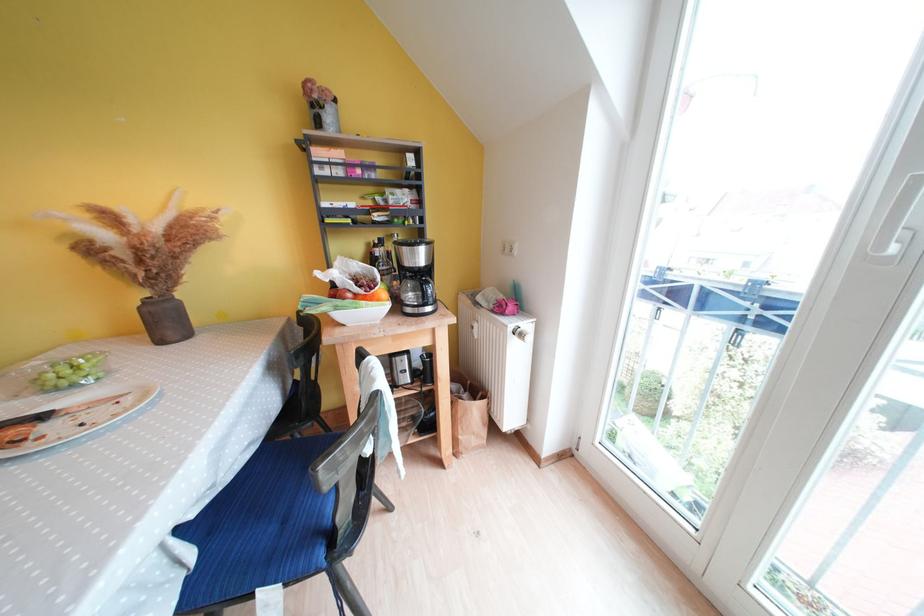
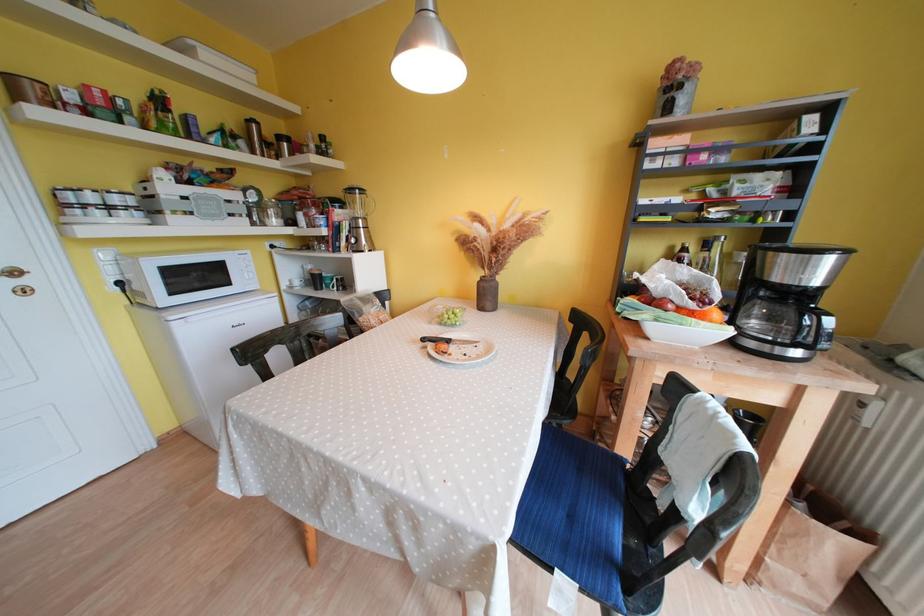
Question: How did the camera likely rotate?

Choices:
 (A) Left
 (B) Right
 (C) Up
 (D) Down

Answer: (A)